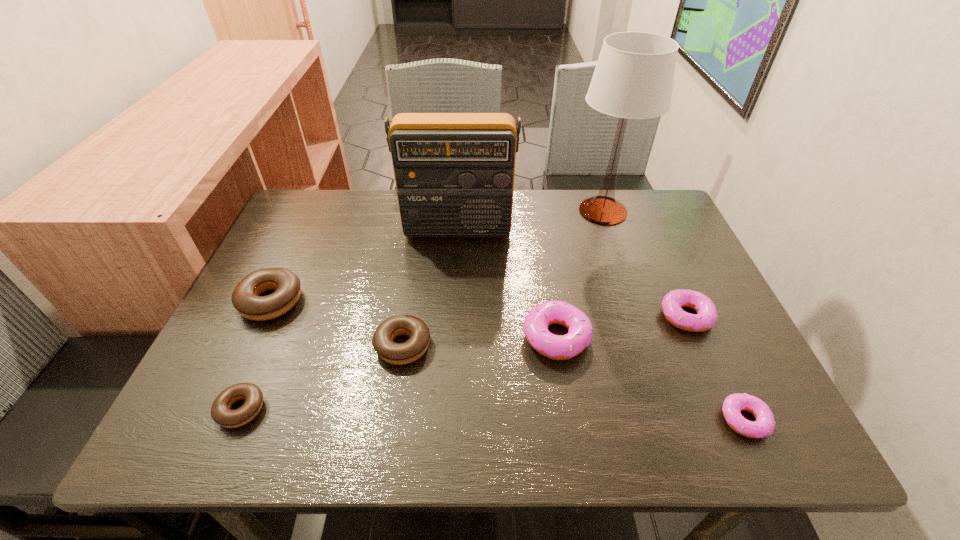
The width and height of the screenshot is (960, 540). What are the coordinates of `vacant region located 0.200m above the cylindrical shade of the tallest object` in the screenshot? It's located at (500, 211).

Where is `vacant space located above the cylindrical shade of the tallest object`? This screenshot has width=960, height=540. vacant space located above the cylindrical shade of the tallest object is located at coordinates (432, 211).

Where is `vacant region located 0.050m above the cylindrical shade of the tallest object`? This screenshot has width=960, height=540. vacant region located 0.050m above the cylindrical shade of the tallest object is located at coordinates (551, 211).

The height and width of the screenshot is (540, 960). What are the coordinates of `vacant area located on the front-facing side of the radio receiver` in the screenshot? It's located at (449, 358).

Locate an element on the screen. The image size is (960, 540). vacant space situated on the back of the biggest brown doughnut is located at coordinates (294, 253).

The image size is (960, 540). What are the coordinates of `vacant space situated 0.310m on the right of the leftmost pink doughnut` in the screenshot? It's located at (732, 336).

What are the coordinates of `vacant point located on the back of the second biggest brown doughnut` in the screenshot? It's located at (418, 251).

Where is `free point located 0.280m on the left of the second smallest pink doughnut`? The width and height of the screenshot is (960, 540). free point located 0.280m on the left of the second smallest pink doughnut is located at coordinates (538, 316).

Locate an element on the screen. This screenshot has height=540, width=960. free spot located on the back of the smallest brown doughnut is located at coordinates (269, 344).

Image resolution: width=960 pixels, height=540 pixels. Find the location of `blank area located on the left of the smallest pink doughnut`. blank area located on the left of the smallest pink doughnut is located at coordinates (651, 420).